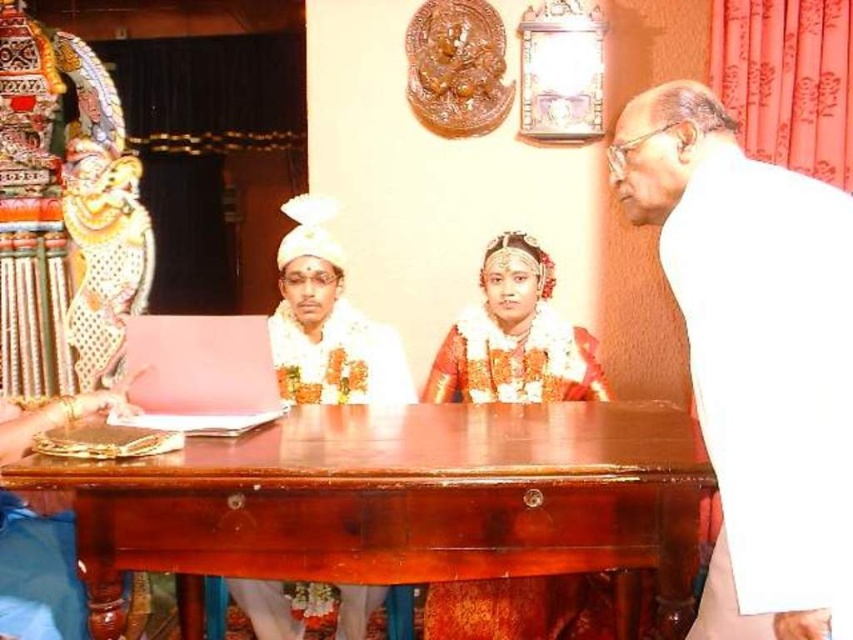
You are a photographer at a traditional Indian wedding. You need to capture a shot where both the white cloth at right and the golden textured saree at center are visible. Based on their positions, which object should you focus on first to ensure both are in frame?

The white cloth at right is in front of the golden textured saree at center, so focusing on the golden textured saree at center first will ensure both are visible in the frame.

You are a photographer at a traditional Indian wedding. You need to capture a photo of the golden textured saree at center and the white satin robe at center. Based on their positions, which one will appear closer to the camera in the photo?

The golden textured saree at center will appear closer to the camera because the white satin robe at center is behind it.

You are a photographer at a traditional Indian wedding ceremony. You need to capture a closeup shot of both the golden textured saree at center and the white satin robe at center. The camera you are using has a maximum focus range of 15 inches. Can you fit both items in the frame without moving the camera?

The distance between the golden textured saree at center and the white satin robe at center is 14.72 inches, which is within the camera maximum focus range of 15 inches. Therefore, you can fit both items in the frame without moving the camera.